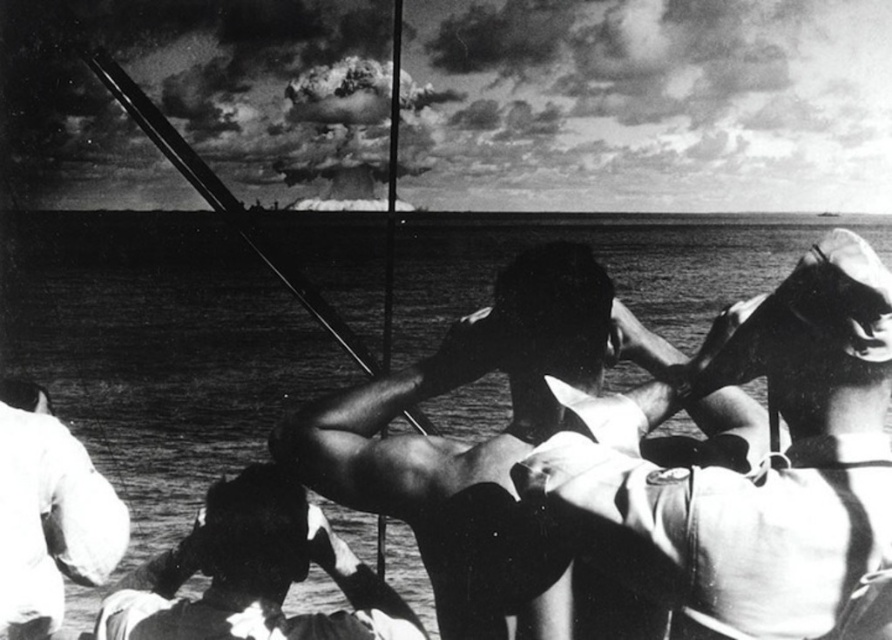
Can you confirm if dark skin man at center is taller than white matte uniform at lower left?

No.

Who is more distant from viewer, (139, 600) or (83, 481)?

The point (83, 481) is more distant.

This screenshot has height=640, width=892. What do you see at coordinates (255, 573) in the screenshot? I see `dark skin man at center` at bounding box center [255, 573].

Locate an element on the screen. This screenshot has height=640, width=892. dark skin man at center is located at coordinates (x=255, y=573).

Between point (622, 465) and point (200, 632), which one is positioned behind?

Positioned behind is point (200, 632).

Can you confirm if smooth skin man at center is positioned to the left of smooth water at center?

Incorrect, smooth skin man at center is not on the left side of smooth water at center.

Is point (683, 605) more distant than point (641, 337)?

No, (683, 605) is closer to viewer.

The width and height of the screenshot is (892, 640). I want to click on smooth skin man at center, so click(758, 468).

Image resolution: width=892 pixels, height=640 pixels. I want to click on smooth water at center, so click(x=401, y=436).

This screenshot has height=640, width=892. Describe the element at coordinates (401, 436) in the screenshot. I see `smooth water at center` at that location.

What are the coordinates of `smooth water at center` in the screenshot? It's located at (401, 436).